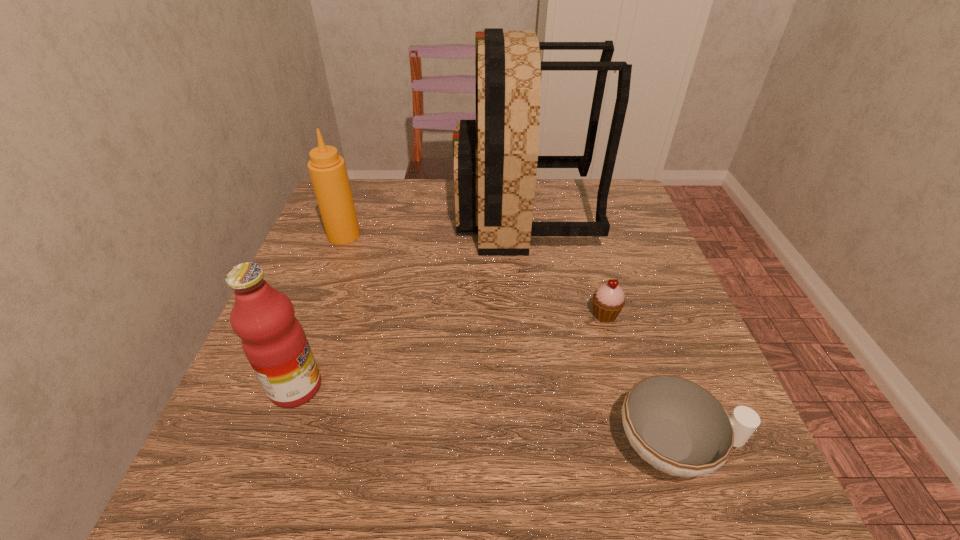
The height and width of the screenshot is (540, 960). I want to click on backpack, so click(495, 158).

This screenshot has width=960, height=540. I want to click on condiment, so click(x=327, y=169).

Image resolution: width=960 pixels, height=540 pixels. In order to click on fruit juice in this screenshot , I will do `click(274, 342)`.

Where is `cupcake`? This screenshot has height=540, width=960. cupcake is located at coordinates (609, 299).

Find the location of a particular element. Image resolution: width=960 pixels, height=540 pixels. chinaware is located at coordinates (677, 426).

Where is `vacant space situated on the front face of the backpack`? Image resolution: width=960 pixels, height=540 pixels. vacant space situated on the front face of the backpack is located at coordinates (x=416, y=213).

This screenshot has width=960, height=540. I want to click on free space located on the front face of the backpack, so click(386, 213).

You are a GUI agent. You are given a task and a screenshot of the screen. Output one action in this format:
    pyautogui.click(x=<x>, y=<y>)
    Task: Click on the blank space located 0.310m on the front face of the backpack
    The height and width of the screenshot is (540, 960).
    Given the screenshot: What is the action you would take?
    pyautogui.click(x=341, y=213)

What are the coordinates of `blank space located on the right of the condiment` in the screenshot? It's located at (420, 235).

You are a GUI agent. You are given a task and a screenshot of the screen. Output one action in this format:
    pyautogui.click(x=<x>, y=<y>)
    Task: Click on the free region located 0.220m on the label of the fruit juice
    The height and width of the screenshot is (540, 960).
    Given the screenshot: What is the action you would take?
    pyautogui.click(x=445, y=387)